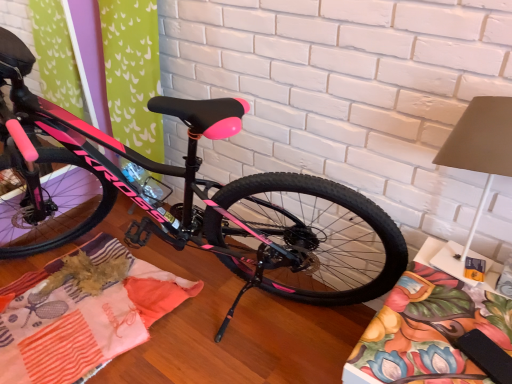
What do you see at coordinates (195, 205) in the screenshot?
I see `pink glossy bicycle at center` at bounding box center [195, 205].

The width and height of the screenshot is (512, 384). In order to click on floral fabric cushion at lower right, arranged as the first blanket when viewed from the right in this screenshot , I will do `click(428, 331)`.

Locate an element on the screen. The height and width of the screenshot is (384, 512). patchwork fabric at center, which appears as the first blanket when viewed from the left is located at coordinates (83, 312).

Locate an element on the screen. Image resolution: width=512 pixels, height=384 pixels. pink glossy bicycle at center is located at coordinates pos(195,205).

From a real-world perspective, is pink glossy bicycle at center positioned under floral fabric cushion at lower right, arranged as the first blanket when viewed from the right, based on gravity?

Actually, pink glossy bicycle at center is physically above floral fabric cushion at lower right, arranged as the first blanket when viewed from the right, in the real world.

Between point (328, 194) and point (390, 330), which one is positioned behind?

The point (328, 194) is behind.

From the picture: Is floral fabric cushion at lower right, which appears as the 2th blanket when viewed from the left, a part of pink glossy bicycle at center?

No, floral fabric cushion at lower right, which appears as the 2th blanket when viewed from the left, is not a part of pink glossy bicycle at center.

Is the depth of pink glossy bicycle at center greater than that of floral fabric cushion at lower right, arranged as the first blanket when viewed from the right?

No, the depth of pink glossy bicycle at center is less than that of floral fabric cushion at lower right, arranged as the first blanket when viewed from the right.

From the picture: Which of these two, patchwork fabric at center, which is counted as the second blanket, starting from the right, or floral fabric cushion at lower right, arranged as the first blanket when viewed from the right, stands shorter?

With less height is patchwork fabric at center, which is counted as the second blanket, starting from the right.

Which is closer to the camera, (45, 375) or (446, 347)?

Point (45, 375).

Would you say patchwork fabric at center, which is counted as the second blanket, starting from the right, is to the left or to the right of floral fabric cushion at lower right, arranged as the first blanket when viewed from the right, in the picture?

From the image, it's evident that patchwork fabric at center, which is counted as the second blanket, starting from the right, is to the left of floral fabric cushion at lower right, arranged as the first blanket when viewed from the right.

How distant is patchwork fabric at center, which appears as the first blanket when viewed from the left, from floral fabric cushion at lower right, which appears as the 2th blanket when viewed from the left?

They are 1.02 meters apart.

Is pink glossy bicycle at center wider than patchwork fabric at center, which is counted as the second blanket, starting from the right?

Correct, the width of pink glossy bicycle at center exceeds that of patchwork fabric at center, which is counted as the second blanket, starting from the right.

From a real-world perspective, which is physically below, pink glossy bicycle at center or patchwork fabric at center, which appears as the first blanket when viewed from the left?

In real-world perspective, patchwork fabric at center, which appears as the first blanket when viewed from the left, is lower.

From the image's perspective, is pink glossy bicycle at center positioned above or below patchwork fabric at center, which appears as the first blanket when viewed from the left?

Based on their image positions, pink glossy bicycle at center is located above patchwork fabric at center, which appears as the first blanket when viewed from the left.

Does pink glossy bicycle at center have a smaller size compared to patchwork fabric at center, which is counted as the second blanket, starting from the right?

Incorrect, pink glossy bicycle at center is not smaller in size than patchwork fabric at center, which is counted as the second blanket, starting from the right.

From the picture: Based on their positions, is patchwork fabric at center, which is counted as the second blanket, starting from the right, located to the left or right of pink glossy bicycle at center?

patchwork fabric at center, which is counted as the second blanket, starting from the right, is to the left of pink glossy bicycle at center.

Is patchwork fabric at center, which is counted as the second blanket, starting from the right, closer to camera compared to pink glossy bicycle at center?

No, patchwork fabric at center, which is counted as the second blanket, starting from the right, is further to the viewer.

How different are the orientations of patchwork fabric at center, which is counted as the second blanket, starting from the right, and pink glossy bicycle at center in degrees?

The angle between the facing direction of patchwork fabric at center, which is counted as the second blanket, starting from the right, and the facing direction of pink glossy bicycle at center is 87.9 degrees.

Could pink glossy bicycle at center be considered to be inside patchwork fabric at center, which appears as the first blanket when viewed from the left?

No, pink glossy bicycle at center is not a part of patchwork fabric at center, which appears as the first blanket when viewed from the left.

Is floral fabric cushion at lower right, which appears as the 2th blanket when viewed from the left, aimed at patchwork fabric at center, which appears as the first blanket when viewed from the left?

No, floral fabric cushion at lower right, which appears as the 2th blanket when viewed from the left, is not oriented towards patchwork fabric at center, which appears as the first blanket when viewed from the left.

Considering the points (352, 366) and (47, 288), which point is behind, point (352, 366) or point (47, 288)?

The point (47, 288) is farther from the camera.

From a real-world perspective, who is located lower, floral fabric cushion at lower right, arranged as the first blanket when viewed from the right, or patchwork fabric at center, which appears as the first blanket when viewed from the left?

patchwork fabric at center, which appears as the first blanket when viewed from the left, from a real-world perspective.

Is floral fabric cushion at lower right, which appears as the 2th blanket when viewed from the left, taller than patchwork fabric at center, which appears as the first blanket when viewed from the left?

Correct, floral fabric cushion at lower right, which appears as the 2th blanket when viewed from the left, is much taller as patchwork fabric at center, which appears as the first blanket when viewed from the left.

From the image's perspective, who appears lower, floral fabric cushion at lower right, which appears as the 2th blanket when viewed from the left, or pink glossy bicycle at center?

floral fabric cushion at lower right, which appears as the 2th blanket when viewed from the left.

How many degrees apart are the facing directions of floral fabric cushion at lower right, arranged as the first blanket when viewed from the right, and pink glossy bicycle at center?

There is a 91.6-degree angle between the facing directions of floral fabric cushion at lower right, arranged as the first blanket when viewed from the right, and pink glossy bicycle at center.

Is floral fabric cushion at lower right, arranged as the first blanket when viewed from the right, to the right of pink glossy bicycle at center from the viewer's perspective?

Correct, you'll find floral fabric cushion at lower right, arranged as the first blanket when viewed from the right, to the right of pink glossy bicycle at center.

Locate an element on the screen. blanket that is the 1st one when counting backward from the pink glossy bicycle at center is located at coordinates click(x=428, y=331).

This screenshot has height=384, width=512. I want to click on blanket on the right of patchwork fabric at center, which appears as the first blanket when viewed from the left, so click(x=428, y=331).

From the image, which object appears to be nearer to floral fabric cushion at lower right, arranged as the first blanket when viewed from the right, pink glossy bicycle at center or patchwork fabric at center, which is counted as the second blanket, starting from the right?

The object closer to floral fabric cushion at lower right, arranged as the first blanket when viewed from the right, is pink glossy bicycle at center.

When comparing their distances from patchwork fabric at center, which appears as the first blanket when viewed from the left, does pink glossy bicycle at center or floral fabric cushion at lower right, arranged as the first blanket when viewed from the right, seem closer?

pink glossy bicycle at center is closer to patchwork fabric at center, which appears as the first blanket when viewed from the left.

Estimate the real-world distances between objects in this image. Which object is closer to patchwork fabric at center, which appears as the first blanket when viewed from the left, floral fabric cushion at lower right, which appears as the 2th blanket when viewed from the left, or pink glossy bicycle at center?

pink glossy bicycle at center is closer to patchwork fabric at center, which appears as the first blanket when viewed from the left.

From the image, which object appears to be nearer to floral fabric cushion at lower right, which appears as the 2th blanket when viewed from the left, patchwork fabric at center, which appears as the first blanket when viewed from the left, or pink glossy bicycle at center?

Based on the image, pink glossy bicycle at center appears to be nearer to floral fabric cushion at lower right, which appears as the 2th blanket when viewed from the left.

Estimate the real-world distances between objects in this image. Which object is closer to pink glossy bicycle at center, patchwork fabric at center, which appears as the first blanket when viewed from the left, or floral fabric cushion at lower right, which appears as the 2th blanket when viewed from the left?

The object closer to pink glossy bicycle at center is patchwork fabric at center, which appears as the first blanket when viewed from the left.

Estimate the real-world distances between objects in this image. Which object is closer to pink glossy bicycle at center, floral fabric cushion at lower right, arranged as the first blanket when viewed from the right, or patchwork fabric at center, which appears as the first blanket when viewed from the left?

The object closer to pink glossy bicycle at center is patchwork fabric at center, which appears as the first blanket when viewed from the left.

What are the coordinates of `bicycle located between patchwork fabric at center, which appears as the first blanket when viewed from the left, and floral fabric cushion at lower right, which appears as the 2th blanket when viewed from the left, in the left-right direction` in the screenshot? It's located at (195, 205).